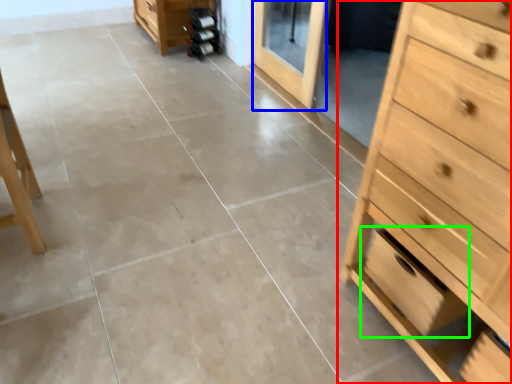
Question: Considering the real-world distances, which object is closest to chest of drawers (highlighted by a red box)? screen door (highlighted by a blue box) or drawer (highlighted by a green box).

Choices:
 (A) screen door
 (B) drawer

Answer: (B)